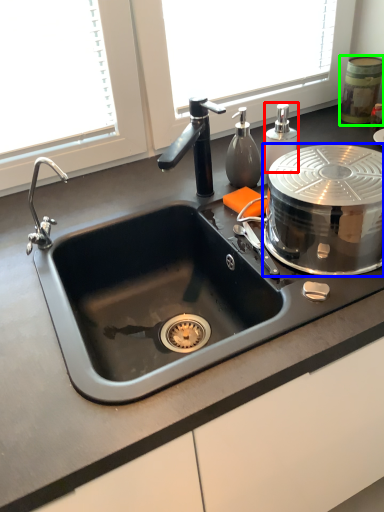
Question: Which is farther away from soap dispenser (highlighted by a red box)? appliance (highlighted by a blue box) or appliance (highlighted by a green box)?

Choices:
 (A) appliance
 (B) appliance

Answer: (B)